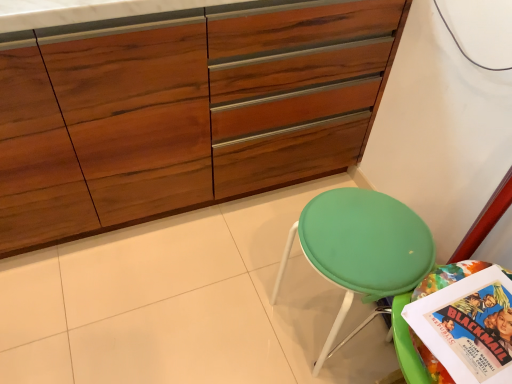
Question: Is green fabric stool at lower right smaller than multicolored paper comic book at lower right?

Choices:
 (A) yes
 (B) no

Answer: (B)

Question: Can you confirm if green fabric stool at lower right is shorter than multicolored paper comic book at lower right?

Choices:
 (A) yes
 (B) no

Answer: (B)

Question: From the image's perspective, is green fabric stool at lower right over multicolored paper comic book at lower right?

Choices:
 (A) yes
 (B) no

Answer: (A)

Question: From a real-world perspective, is green fabric stool at lower right below multicolored paper comic book at lower right?

Choices:
 (A) yes
 (B) no

Answer: (A)

Question: Is the depth of green fabric stool at lower right less than that of multicolored paper comic book at lower right?

Choices:
 (A) no
 (B) yes

Answer: (A)

Question: Does green fabric stool at lower right have a larger size compared to multicolored paper comic book at lower right?

Choices:
 (A) yes
 (B) no

Answer: (A)

Question: Could you tell me if wooden cabinet at center is turned towards green fabric stool at lower right?

Choices:
 (A) no
 (B) yes

Answer: (B)

Question: Is wooden cabinet at center wider than green fabric stool at lower right?

Choices:
 (A) yes
 (B) no

Answer: (A)

Question: Is green fabric stool at lower right a part of wooden cabinet at center?

Choices:
 (A) no
 (B) yes

Answer: (A)

Question: From a real-world perspective, is wooden cabinet at center under green fabric stool at lower right?

Choices:
 (A) no
 (B) yes

Answer: (A)

Question: Is wooden cabinet at center far away from green fabric stool at lower right?

Choices:
 (A) no
 (B) yes

Answer: (A)

Question: Can you confirm if wooden cabinet at center is smaller than green fabric stool at lower right?

Choices:
 (A) no
 (B) yes

Answer: (A)

Question: From a real-world perspective, is green fabric stool at lower right physically below wooden cabinet at center?

Choices:
 (A) no
 (B) yes

Answer: (B)